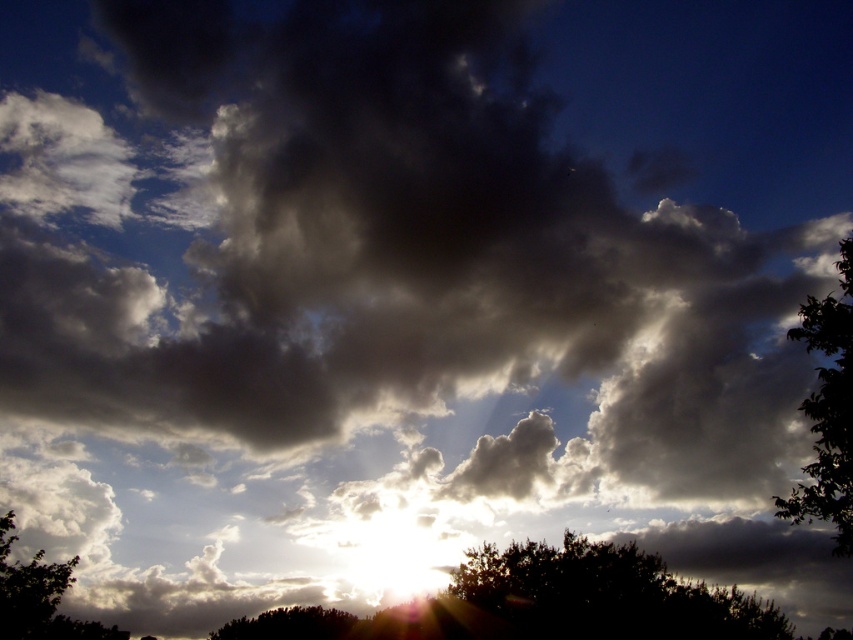
How far apart are black matte tree at center and dark green leafy tree at lower center?

black matte tree at center and dark green leafy tree at lower center are 24.95 meters apart.

Does black matte tree at center have a lesser width compared to dark green leafy tree at lower center?

No, black matte tree at center is not thinner than dark green leafy tree at lower center.

In order to click on black matte tree at center in this screenshot , I will do `click(606, 595)`.

Identify the location of black matte tree at center. Image resolution: width=853 pixels, height=640 pixels. (606, 595).

Can you confirm if black matte tree at center is bigger than dark green leafy tree at right?

No, black matte tree at center is not bigger than dark green leafy tree at right.

This screenshot has height=640, width=853. I want to click on black matte tree at center, so click(606, 595).

Is dark green leafy tree at right to the right of green leafy tree at lower left from the viewer's perspective?

Indeed, dark green leafy tree at right is positioned on the right side of green leafy tree at lower left.

From the picture: Who is positioned more to the right, dark green leafy tree at right or green leafy tree at lower left?

From the viewer's perspective, dark green leafy tree at right appears more on the right side.

Is point (836, 356) less distant than point (126, 632)?

Yes, point (836, 356) is closer to viewer.

Where is `dark green leafy tree at right`? The image size is (853, 640). dark green leafy tree at right is located at coordinates (827, 412).